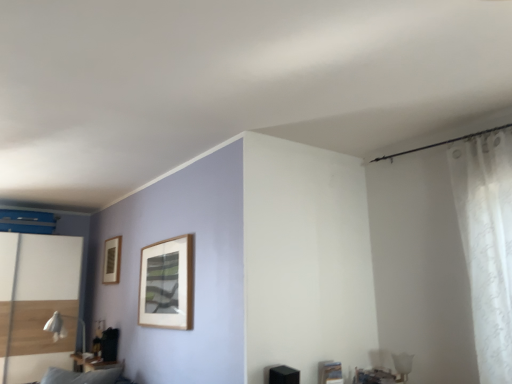
Locate an element on the screen. The width and height of the screenshot is (512, 384). white fabric table lamp at lower left is located at coordinates (64, 328).

The height and width of the screenshot is (384, 512). In order to click on white sheer curtain at right in this screenshot , I will do `click(487, 244)`.

Where is `white fabric table lamp at lower left`? Image resolution: width=512 pixels, height=384 pixels. white fabric table lamp at lower left is located at coordinates (64, 328).

Does point (76, 361) come in front of point (510, 195)?

That is False.

Who is smaller, matte black table at lower left or white sheer curtain at right?

Smaller between the two is matte black table at lower left.

From a real-world perspective, which is physically above, matte black table at lower left or white sheer curtain at right?

white sheer curtain at right.

Is matte black table at lower left oriented towards white sheer curtain at right?

No.

Would you say matte black table at lower left is a long distance from wooden picture frame at upper left?

They are positioned close to each other.

Can you confirm if matte black table at lower left is bigger than wooden picture frame at upper left?

Actually, matte black table at lower left might be smaller than wooden picture frame at upper left.

From the image's perspective, is matte black table at lower left located above or below wooden picture frame at upper left?

Based on their image positions, matte black table at lower left is located beneath wooden picture frame at upper left.

Where is `picture frame lying above the matte black table at lower left (from the image's perspective)`? picture frame lying above the matte black table at lower left (from the image's perspective) is located at coordinates (112, 260).

Considering the points (55, 338) and (114, 283), which point is in front, point (55, 338) or point (114, 283)?

The point (114, 283) is closer.

Is white fabric table lamp at lower left facing towards wooden picture frame at upper left?

No.

Considering the positions of objects white fabric table lamp at lower left and wooden picture frame at upper left in the image provided, who is more to the right, white fabric table lamp at lower left or wooden picture frame at upper left?

wooden picture frame at upper left.

Between matte black table at lower left and white fabric table lamp at lower left, which one has more height?

With more height is white fabric table lamp at lower left.

In the scene shown: Considering the relative positions of matte black table at lower left and white fabric table lamp at lower left in the image provided, is matte black table at lower left behind white fabric table lamp at lower left?

Yes, matte black table at lower left is behind white fabric table lamp at lower left.

Is the surface of matte black table at lower left in direct contact with white fabric table lamp at lower left?

No, matte black table at lower left is not beside white fabric table lamp at lower left.

Image resolution: width=512 pixels, height=384 pixels. Identify the location of table below the white fabric table lamp at lower left (from the image's perspective). (92, 363).

Does white glossy screen door at left touch matte black table at lower left?

white glossy screen door at left is not next to matte black table at lower left, and they're not touching.

From the image's perspective, is white glossy screen door at left located beneath matte black table at lower left?

No, from the image's perspective, white glossy screen door at left is not beneath matte black table at lower left.

Considering the relative sizes of white glossy screen door at left and matte black table at lower left in the image provided, is white glossy screen door at left thinner than matte black table at lower left?

No.

Which object is closer to the camera taking this photo, wooden picture frame at upper left or matte black table at lower left?

matte black table at lower left is more forward.

Which object is wider, wooden picture frame at upper left or matte black table at lower left?

With larger width is matte black table at lower left.

Between wooden picture frame at upper left and matte black table at lower left, which one appears on the right side from the viewer's perspective?

wooden picture frame at upper left.

Where is `picture frame above the white sheer curtain at right (from a real-world perspective)`? The image size is (512, 384). picture frame above the white sheer curtain at right (from a real-world perspective) is located at coordinates (112, 260).

Considering the sizes of objects white sheer curtain at right and wooden picture frame at upper left in the image provided, who is bigger, white sheer curtain at right or wooden picture frame at upper left?

white sheer curtain at right.

Can you tell me how much white sheer curtain at right and wooden picture frame at upper left differ in facing direction?

The angle between the facing direction of white sheer curtain at right and the facing direction of wooden picture frame at upper left is 1.64 degrees.

Do you think white sheer curtain at right is within wooden picture frame at upper left, or outside of it?

white sheer curtain at right is located beyond the bounds of wooden picture frame at upper left.

What are the coordinates of `curtain above the matte black table at lower left (from a real-world perspective)` in the screenshot? It's located at (487, 244).

Locate an element on the screen. Image resolution: width=512 pixels, height=384 pixels. table below the wooden picture frame at upper left (from the image's perspective) is located at coordinates (92, 363).

When comparing their distances from wooden picture frame at upper left, does white sheer curtain at right or matte black table at lower left seem closer?

Among the two, matte black table at lower left is located nearer to wooden picture frame at upper left.

Considering their positions, is wooden picture frame at upper left positioned further to white glossy screen door at left than white fabric table lamp at lower left?

The object further to white glossy screen door at left is white fabric table lamp at lower left.

Looking at the image, which one is located closer to matte black table at lower left, white sheer curtain at right or white fabric table lamp at lower left?

white fabric table lamp at lower left is closer to matte black table at lower left.

Considering their positions, is white glossy screen door at left positioned closer to white fabric table lamp at lower left than wooden picture frame at upper left?

Among the two, wooden picture frame at upper left is located nearer to white fabric table lamp at lower left.

Which object lies further to the anchor point wooden picture frame at upper left, matte black table at lower left or white fabric table lamp at lower left?

Among the two, matte black table at lower left is located further to wooden picture frame at upper left.

Estimate the real-world distances between objects in this image. Which object is further from white fabric table lamp at lower left, white sheer curtain at right or wooden picture frame at upper left?

white sheer curtain at right.

Estimate the real-world distances between objects in this image. Which object is further from white glossy screen door at left, white sheer curtain at right or matte black table at lower left?

The object further to white glossy screen door at left is white sheer curtain at right.

When comparing their distances from white glossy screen door at left, does matte black table at lower left or white sheer curtain at right seem further?

white sheer curtain at right lies further to white glossy screen door at left than the other object.

This screenshot has width=512, height=384. I want to click on picture frame between white fabric table lamp at lower left and white sheer curtain at right from left to right, so click(112, 260).

Locate an element on the screen. This screenshot has height=384, width=512. picture frame between white glossy screen door at left and white sheer curtain at right in the horizontal direction is located at coordinates (112, 260).

Locate an element on the screen. The width and height of the screenshot is (512, 384). table between white fabric table lamp at lower left and white sheer curtain at right is located at coordinates (92, 363).

The image size is (512, 384). Identify the location of picture frame between matte black table at lower left and white sheer curtain at right from left to right. (112, 260).